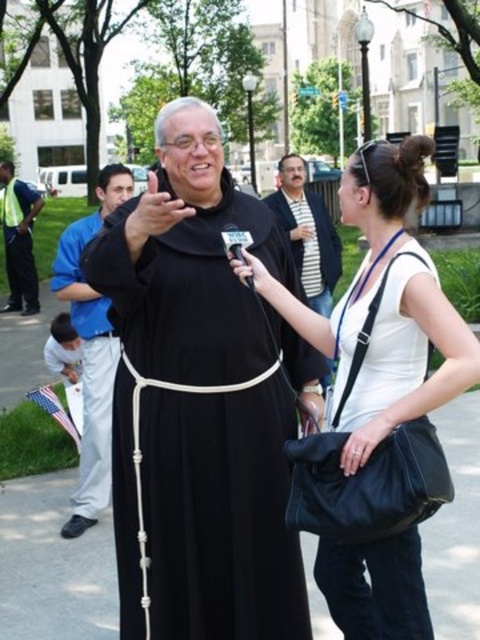
You are a fashion designer observing the scene and want to create a new collection inspired by the attire of the religious figure and the interviewer. Which of the two items, the black matte dress at center or the black matte suit at center, would you choose to feature as the centerpiece of your collection if you want to emphasize a more modest and understated style?

The black matte dress at center has a smaller size compared to the black matte suit at center, making it a better choice for emphasizing a modest and understated style.

You are a photographer trying to capture a portrait of the religious figure in the scene. You notice the white matte bag at center and the black matte suit at center in your frame. Which object should you adjust to avoid blocking the religious figure, and why?

You should adjust the white matte bag at center because it is not as tall as the black matte suit at center, making it more likely to be positioned lower and potentially obstructing the religious figure in the frame.